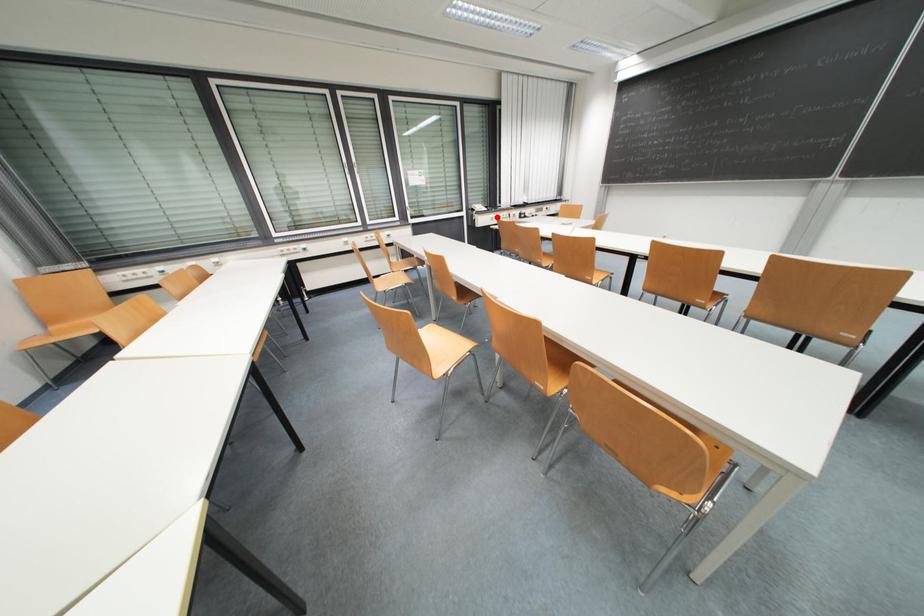
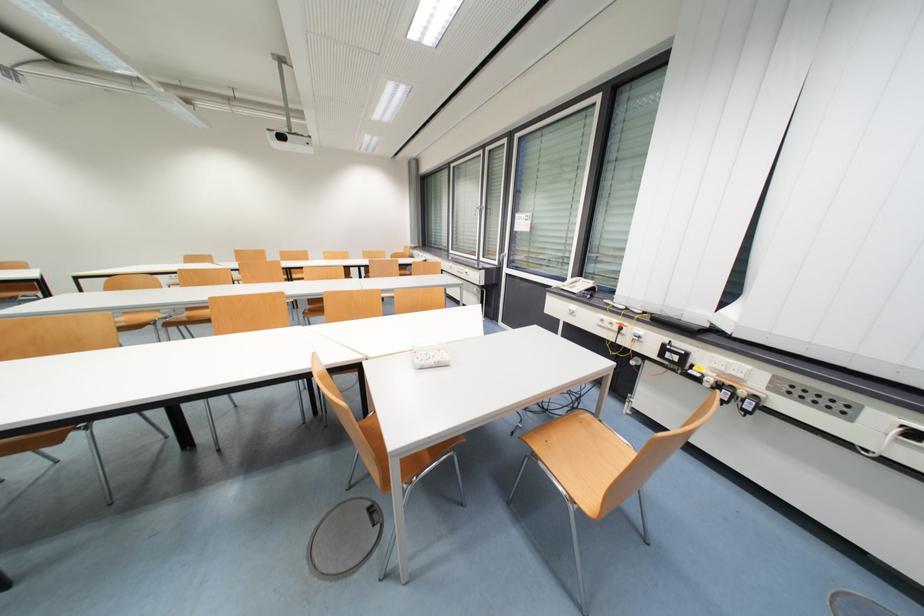
Question: I am providing you with two images of the same scene from different viewpoints. A red point is shown in image1. For the corresponding object point in image2, is it positioned nearer or farther from the camera?

Choices:
 (A) Nearer
 (B) Farther

Answer: (B)